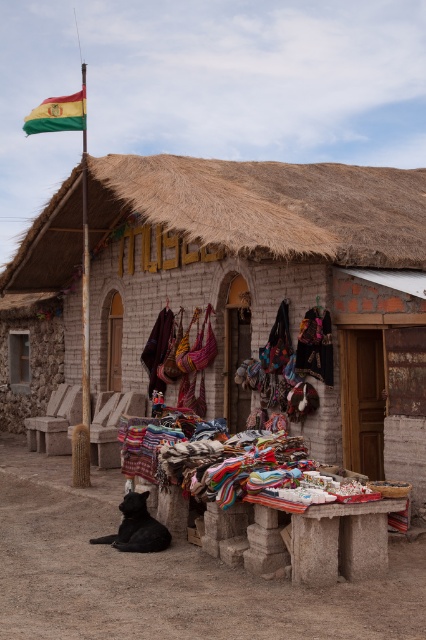
Question: Is thatched straw hut at center above bright yellow-green fabric flag at upper left?

Choices:
 (A) yes
 (B) no

Answer: (B)

Question: Which point appears closest to the camera in this image?

Choices:
 (A) (305, 349)
 (B) (42, 115)
 (C) (184, 282)

Answer: (A)

Question: Is multicolored woven fabric at center above textured woolen shawl at center?

Choices:
 (A) no
 (B) yes

Answer: (B)

Question: Can you confirm if multicolored woven fabric at center is smaller than textured woolen shawl at center?

Choices:
 (A) yes
 (B) no

Answer: (A)

Question: Which of the following is the farthest from the observer?

Choices:
 (A) bright yellow-green fabric flag at upper left
 (B) multicolored woven fabric at center

Answer: (A)

Question: Based on their relative distances, which object is nearer to the bright yellow-green fabric flag at upper left?

Choices:
 (A) multicolored woven fabric at center
 (B) thatched straw hut at center
 (C) textured woolen shawl at center

Answer: (B)